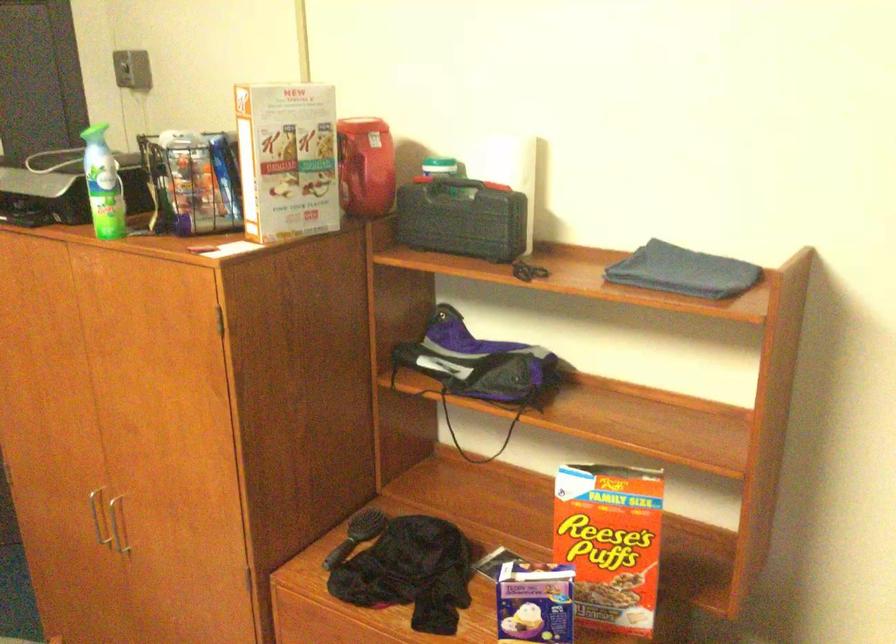
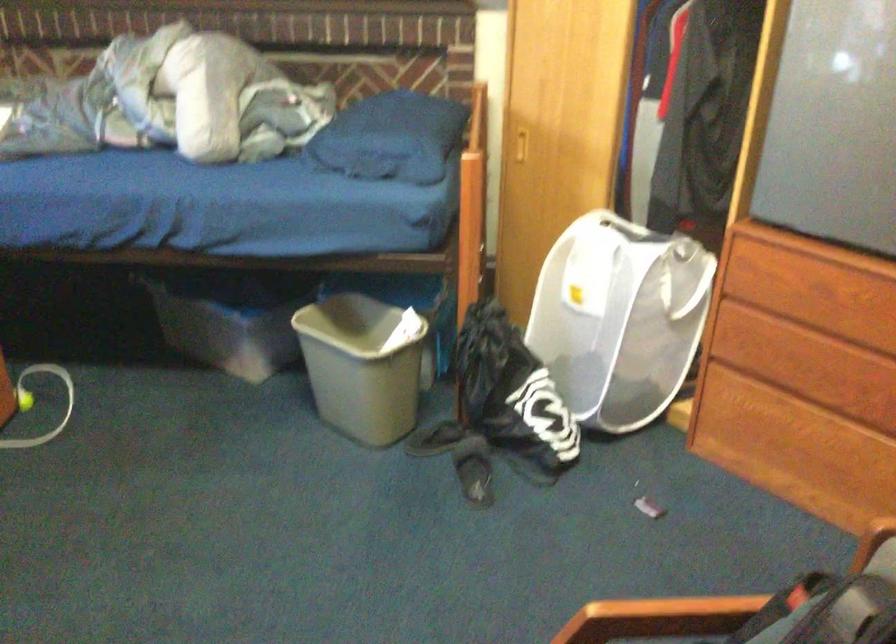
The images are taken continuously from a first-person perspective. In which direction is your viewpoint rotating?

The rotation direction of the camera is left-down.